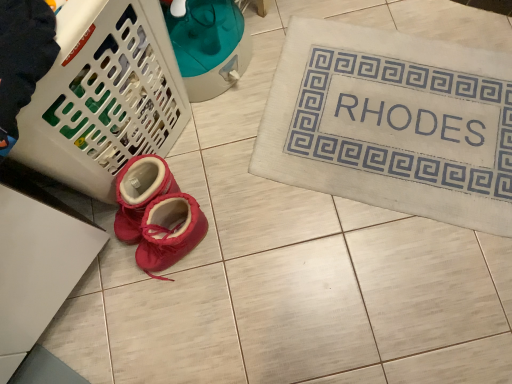
This screenshot has height=384, width=512. I want to click on free space above beige fabric bath mat at upper right (from a real-world perspective), so click(x=395, y=119).